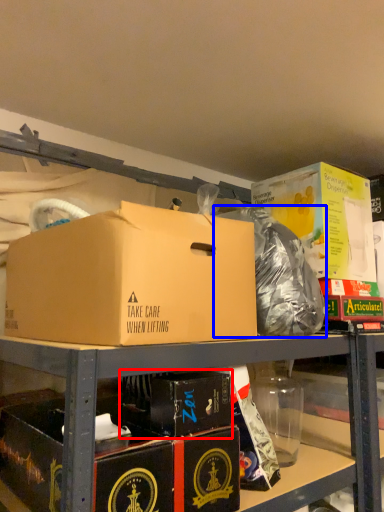
Question: Which object is further to the camera taking this photo, box (highlighted by a red box) or garbage (highlighted by a blue box)?

Choices:
 (A) box
 (B) garbage

Answer: (B)